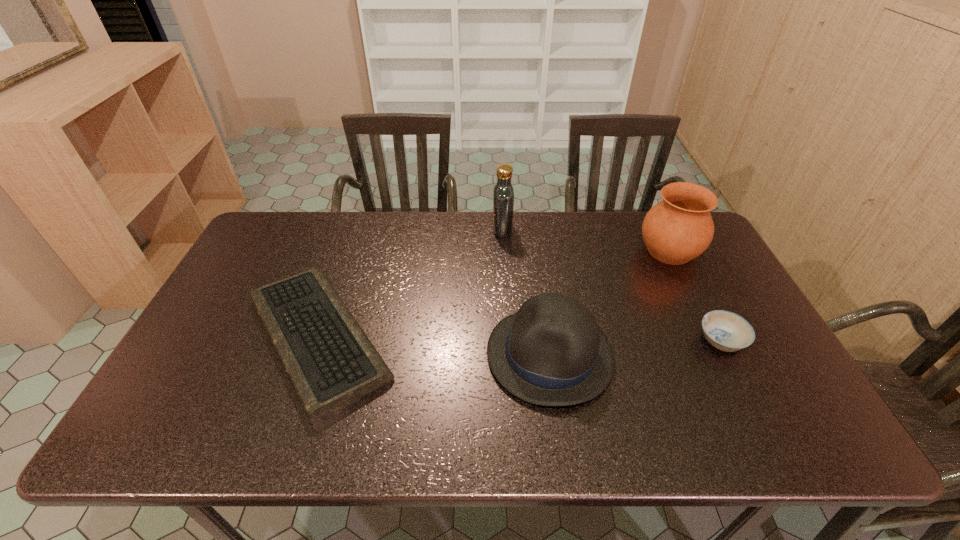
Where is `vodka`? vodka is located at coordinates (503, 193).

You are a GUI agent. You are given a task and a screenshot of the screen. Output one action in this format:
    pyautogui.click(x=<x>, y=<y>)
    Task: Click on the pottery
    The image size is (960, 540).
    Given the screenshot: What is the action you would take?
    [679, 228]

Locate an element on the screen. The image size is (960, 540). the third tallest object is located at coordinates (551, 352).

I want to click on bowl, so click(727, 331).

The height and width of the screenshot is (540, 960). In order to click on computer keyboard in this screenshot , I will do `click(330, 361)`.

The width and height of the screenshot is (960, 540). What are the coordinates of `vacant space located 0.210m on the front-facing side of the vodka` in the screenshot? It's located at (432, 228).

This screenshot has width=960, height=540. What are the coordinates of `vacant space positioned on the front-facing side of the vodka` in the screenshot? It's located at (389, 228).

Where is `vacant region located 0.400m on the front-facing side of the vodka`? Image resolution: width=960 pixels, height=540 pixels. vacant region located 0.400m on the front-facing side of the vodka is located at coordinates (377, 228).

Find the location of a particular element. The height and width of the screenshot is (540, 960). free space located on the front of the pottery is located at coordinates [731, 376].

You are a GUI agent. You are given a task and a screenshot of the screen. Output one action in this format:
    pyautogui.click(x=<x>, y=<y>)
    Task: Click on the vacant area situated 0.080m on the front-facing side of the third shortest object
    
    Given the screenshot: What is the action you would take?
    pyautogui.click(x=456, y=354)